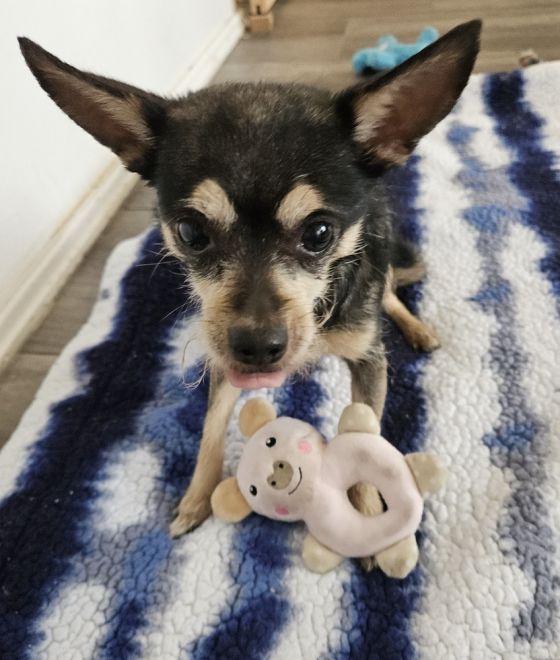
Identify the location of wooden blocks. The height and width of the screenshot is (660, 560). (267, 22), (261, 6).